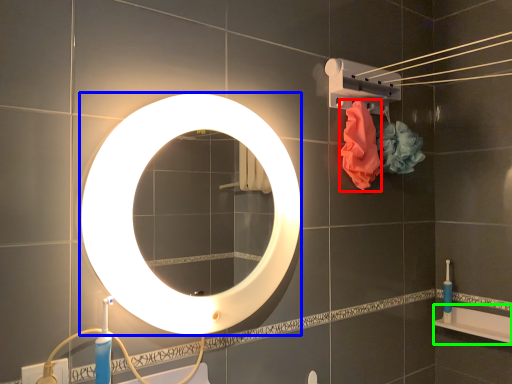
Question: Which object is positioned closest to flower (highlighted by a red box)? Select from mirror (highlighted by a blue box) and bath (highlighted by a green box).

Choices:
 (A) mirror
 (B) bath

Answer: (A)